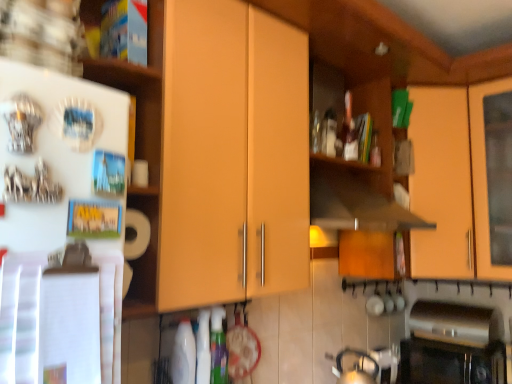
Question: From the image's perspective, is silver metallic tea pot at lower right located above white paper towel at left, which ranks as the 1th shelf in bottom-to-top order?

Choices:
 (A) no
 (B) yes

Answer: (A)

Question: Does silver metallic tea pot at lower right have a greater height compared to white paper towel at left, which ranks as the 1th shelf in bottom-to-top order?

Choices:
 (A) no
 (B) yes

Answer: (A)

Question: Is silver metallic tea pot at lower right in front of white paper towel at left, which ranks as the 1th shelf in bottom-to-top order?

Choices:
 (A) no
 (B) yes

Answer: (A)

Question: Is silver metallic tea pot at lower right smaller than white paper towel at left, which ranks as the 1th shelf in bottom-to-top order?

Choices:
 (A) no
 (B) yes

Answer: (B)

Question: Does silver metallic tea pot at lower right appear on the left side of white paper towel at left, which ranks as the 1th shelf in bottom-to-top order?

Choices:
 (A) no
 (B) yes

Answer: (A)

Question: Can you confirm if silver metallic tea pot at lower right is positioned to the right of white paper towel at left, which ranks as the 1th shelf in bottom-to-top order?

Choices:
 (A) no
 (B) yes

Answer: (B)

Question: Is matte orange cabinet at upper right, the second cabinetry from the front, positioned with its back to matte wood cabinet at center, acting as the first cabinetry starting from the left?

Choices:
 (A) no
 (B) yes

Answer: (A)

Question: From the image's perspective, does matte orange cabinet at upper right, placed as the second cabinetry when sorted from left to right, appear higher than matte wood cabinet at center, acting as the 2th cabinetry starting from the back?

Choices:
 (A) yes
 (B) no

Answer: (B)

Question: Can we say matte orange cabinet at upper right, the second cabinetry from the front, lies outside matte wood cabinet at center, marked as the 2th cabinetry in a right-to-left arrangement?

Choices:
 (A) no
 (B) yes

Answer: (B)

Question: Is matte orange cabinet at upper right, the second cabinetry from the front, not close to matte wood cabinet at center, acting as the first cabinetry starting from the left?

Choices:
 (A) no
 (B) yes

Answer: (B)

Question: Is matte orange cabinet at upper right, arranged as the first cabinetry when viewed from the right, touching matte wood cabinet at center, acting as the 2th cabinetry starting from the back?

Choices:
 (A) yes
 (B) no

Answer: (B)

Question: From a real-world perspective, is matte orange cabinet at upper right, the 1th cabinetry from the back, located higher than matte wood cabinet at center, which is the first cabinetry from front to back?

Choices:
 (A) yes
 (B) no

Answer: (B)

Question: Is matte orange cabinet at upper right, the second cabinetry from the front, positioned before white paper towel at left, the 2th shelf positioned from the top?

Choices:
 (A) yes
 (B) no

Answer: (B)